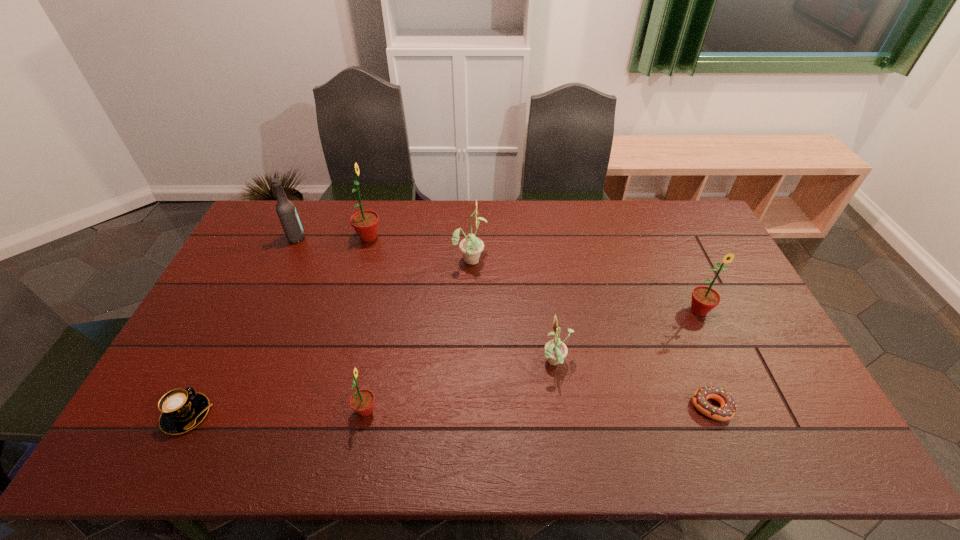
At what (x,y) coordinates should I click in order to perform the action: click on free space between the nearer yellow sunflower and the beer bottle. Please return your answer as a coordinate pair (x, y). This screenshot has height=540, width=960. Looking at the image, I should click on (426, 301).

This screenshot has height=540, width=960. I want to click on free spot between the leftmost sunflower and the fourth object from left to right, so click(x=367, y=324).

Where is `free spot between the fifth nearest object and the second sunflower from left to right`? The height and width of the screenshot is (540, 960). free spot between the fifth nearest object and the second sunflower from left to right is located at coordinates (532, 360).

Where is `vacant area that lies between the shortest object and the second shortest object`? The width and height of the screenshot is (960, 540). vacant area that lies between the shortest object and the second shortest object is located at coordinates (448, 411).

Identify the location of vacant area between the farther yellow sunflower and the fifth nearest object. The height and width of the screenshot is (540, 960). (585, 285).

Locate an element on the screen. The height and width of the screenshot is (540, 960). free spot between the second farthest green sunflower and the tallest sunflower is located at coordinates (534, 274).

Find the location of `the seventh closest object to the fifth object from left to right`. the seventh closest object to the fifth object from left to right is located at coordinates (181, 410).

Where is `the second closest object to the second smallest green sunflower`? The height and width of the screenshot is (540, 960). the second closest object to the second smallest green sunflower is located at coordinates (555, 350).

The image size is (960, 540). I want to click on sunflower that is the third nearest to the fourth farthest sunflower, so click(x=362, y=401).

Identify which sunflower is the fourth nearest to the rightmost green sunflower. Please provide its 2D coordinates. Your answer should be formatted as a tuple, i.e. [(x, y)], where the tuple contains the x and y coordinates of a point satisfying the conditions above.

[(365, 222)]